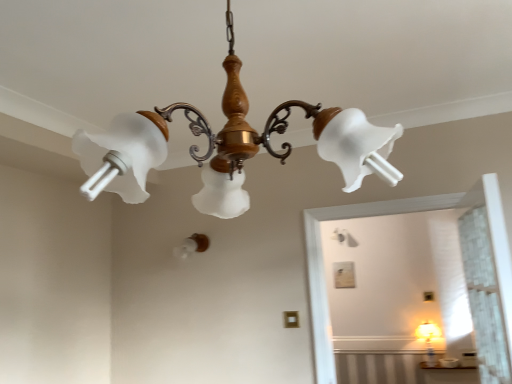
Question: Considering the positions of matte glass chandelier at upper center, the 1th lamp when ordered from front to back, and white frosted bulb at center, the 1th lamp when ordered from bottom to top, in the image, is matte glass chandelier at upper center, the 1th lamp when ordered from front to back, taller or shorter than white frosted bulb at center, the 1th lamp when ordered from bottom to top,?

Choices:
 (A) tall
 (B) short

Answer: (A)

Question: Is point (223, 153) closer or farther from the camera than point (198, 236)?

Choices:
 (A) farther
 (B) closer

Answer: (B)

Question: Looking at their shapes, would you say matte glass chandelier at upper center, the 1th lamp when ordered from front to back, is wider or thinner than white frosted bulb at center, placed as the second lamp when sorted from front to back?

Choices:
 (A) wide
 (B) thin

Answer: (A)

Question: In terms of size, does white frosted bulb at center, acting as the 1th lamp starting from the back, appear bigger or smaller than matte glass chandelier at upper center, the 1th lamp when ordered from front to back?

Choices:
 (A) small
 (B) big

Answer: (A)

Question: Would you say white frosted bulb at center, placed as the second lamp when sorted from front to back, is to the left or to the right of matte glass chandelier at upper center, the 2th lamp viewed from the left, in the picture?

Choices:
 (A) left
 (B) right

Answer: (A)

Question: From a real-world perspective, is white frosted bulb at center, positioned as the 2th lamp in right-to-left order, above or below matte glass chandelier at upper center, which appears as the first lamp when viewed from the right?

Choices:
 (A) above
 (B) below

Answer: (B)

Question: From the image's perspective, is white frosted bulb at center, the 1th lamp when ordered from bottom to top, above or below matte glass chandelier at upper center, acting as the 1th lamp starting from the top?

Choices:
 (A) below
 (B) above

Answer: (A)